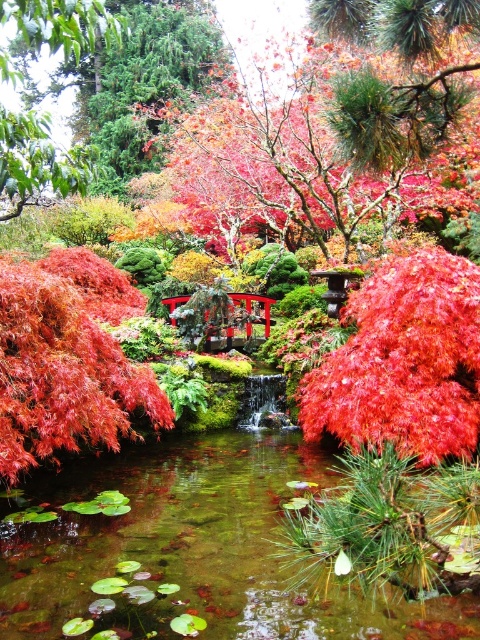
You are standing at the center of the Japanese garden and want to pick up the vivid red maple leaf at center. Which direction should you move to reach it?

The vivid red maple leaf at center is located at point 0.566 on the x axis and 0.842 on the y axis. Since the coordinate system starts at the bottom left corner, moving towards the upper right would increase both coordinates. To reach the leaf, you should move northeast, as the leaf is northeast of the center point.

You are a gardener in the Japanese garden and you want to place a decorative stone between the vivid red maple leaf at center and the shiny red maple at center. Based on their positions, where should you place the stone?

The vivid red maple leaf at center is located below the shiny red maple at center, so you should place the decorative stone between them by positioning it above the vivid red maple leaf at center and below the shiny red maple at center.

Consider the image. You are a gardener planning to prune the plants in the Japanese garden. You need to know which one is taller between the vivid red maple leaf at center and the shiny red maple at center. Which one should you focus on first for pruning?

The vivid red maple leaf at center is much taller than the shiny red maple at center, so you should focus on pruning the vivid red maple leaf at center first.